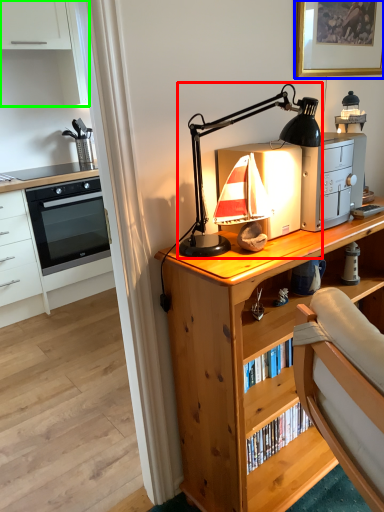
Question: Which object is positioned farthest from lamp (highlighted by a red box)? Select from picture frame (highlighted by a blue box) and cabinetry (highlighted by a green box).

Choices:
 (A) picture frame
 (B) cabinetry

Answer: (B)